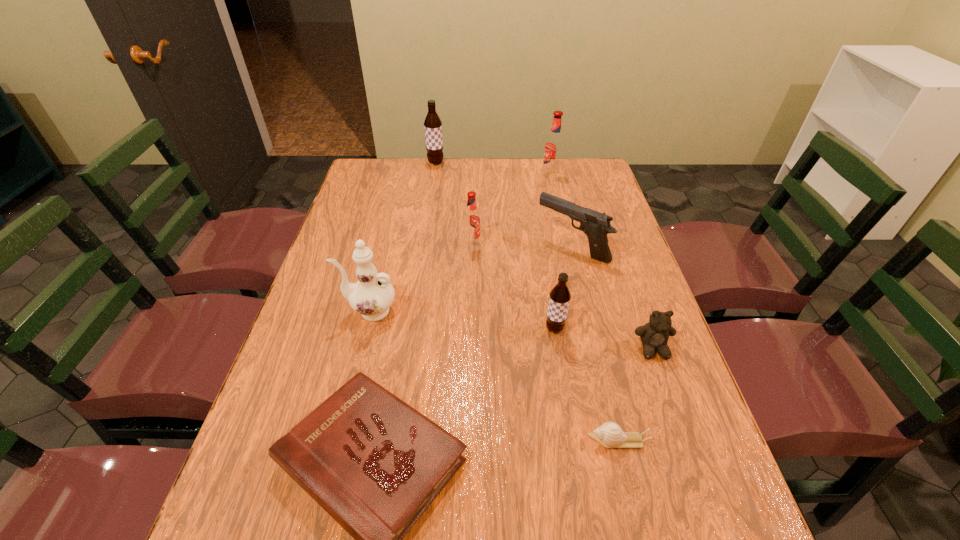
Identify the location of vacant area that lies between the shortest object and the chinaware. (493, 376).

Find the location of a particular element. free space between the shortest object and the left red root beer is located at coordinates [545, 342].

This screenshot has width=960, height=540. In order to click on empty space that is in between the chinaware and the third root beer from right to left in this screenshot , I will do `click(420, 277)`.

This screenshot has width=960, height=540. What are the coordinates of `object identified as the fifth closest to the black gun` in the screenshot? It's located at (373, 294).

This screenshot has width=960, height=540. Find the location of `the second closest object to the third root beer from right to left`. the second closest object to the third root beer from right to left is located at coordinates (373, 294).

Select which root beer is the second closest to the eighth tallest object. Please provide its 2D coordinates. Your answer should be formatted as a tuple, i.e. [(x, y)], where the tuple contains the x and y coordinates of a point satisfying the conditions above.

[(471, 218)]

Image resolution: width=960 pixels, height=540 pixels. Identify the location of root beer identified as the third closest to the left brown root beer. (559, 297).

Where is `free space that satisfies the following two spatial constraints: 1. on the front side of the farther brown root beer; 2. on the left side of the smaller red root beer`? The image size is (960, 540). free space that satisfies the following two spatial constraints: 1. on the front side of the farther brown root beer; 2. on the left side of the smaller red root beer is located at coordinates (423, 244).